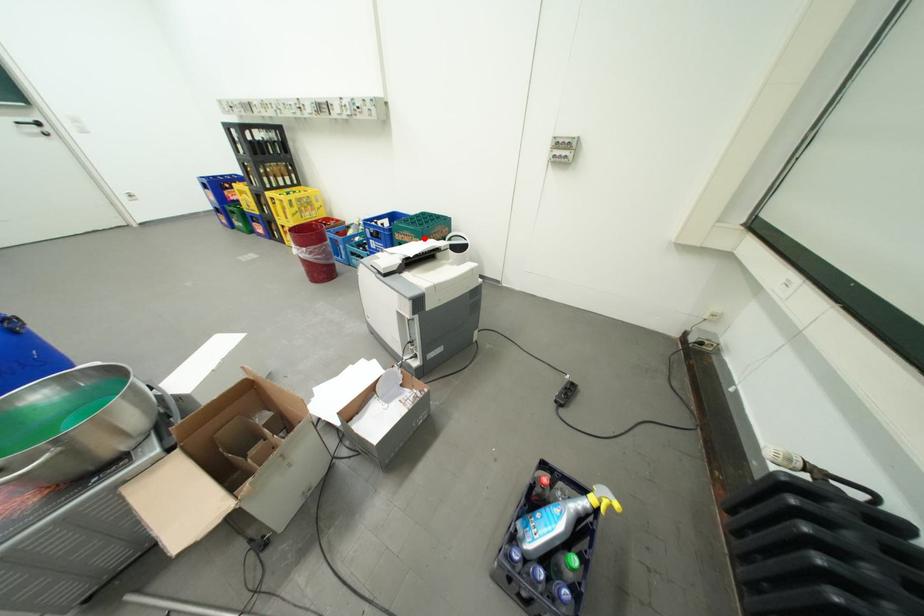
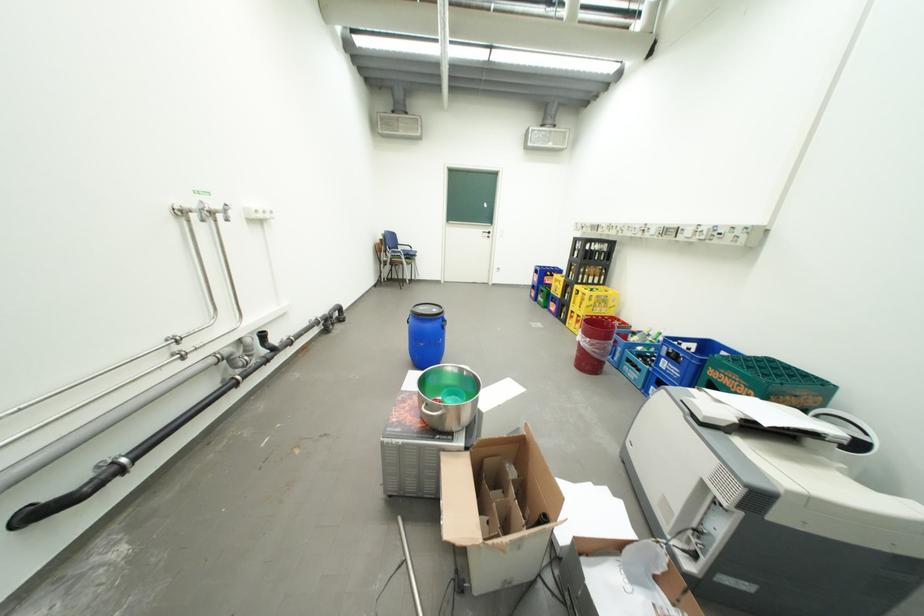
Where in the second image is the point corresponding to the highlighted location from the first image?

(756, 387)